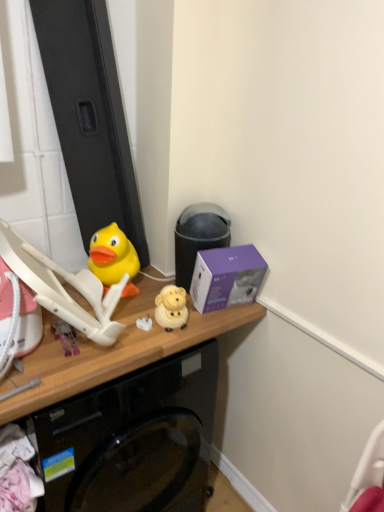
You are a GUI agent. You are given a task and a screenshot of the screen. Output one action in this format:
    pyautogui.click(x=<x>, y=<y>)
    Task: Click on the free space to the back side of white matte plug at center, which appears as the third toy when viewed from the left
    The image size is (384, 512).
    Given the screenshot: What is the action you would take?
    pyautogui.click(x=139, y=298)